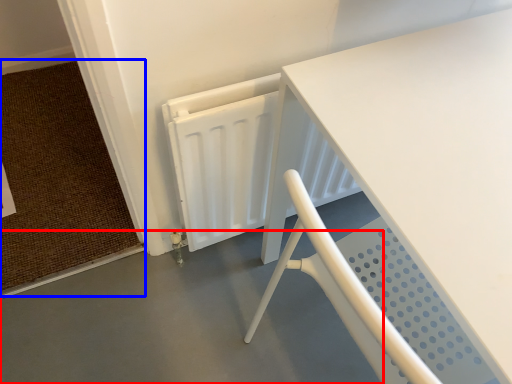
Question: Which point is further to the camera, concrete (highlighted by a red box) or doormat (highlighted by a blue box)?

Choices:
 (A) concrete
 (B) doormat

Answer: (B)